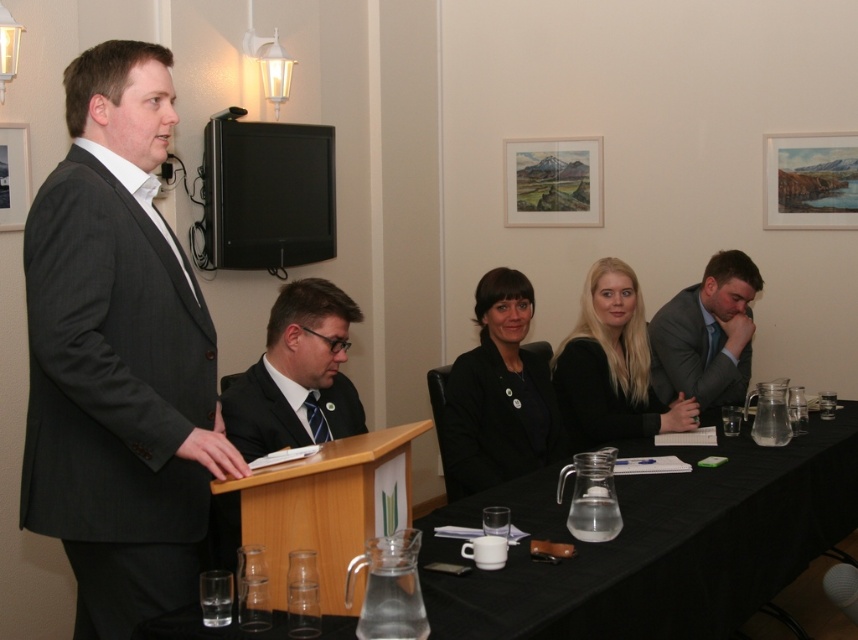
Question: Among these objects, which one is nearest to the camera?

Choices:
 (A) black matte jacket at center
 (B) black matte business suit at center
 (C) wooden podium at center

Answer: (C)

Question: Based on their relative distances, which object is farther from the blonde hair at center?

Choices:
 (A) wooden podium at center
 (B) matte black suit at right
 (C) black matte business suit at center

Answer: (A)

Question: Which point is closer to the camera taking this photo?

Choices:
 (A) (97, 296)
 (B) (300, 296)
 (C) (600, 378)

Answer: (A)

Question: Considering the relative positions of blonde hair at center and matte black suit at right in the image provided, where is blonde hair at center located with respect to matte black suit at right?

Choices:
 (A) above
 (B) below

Answer: (B)

Question: Is black matte jacket at center thinner than black matte business suit at center?

Choices:
 (A) no
 (B) yes

Answer: (B)

Question: Is dark gray suit at left to the right of clear glass table at center from the viewer's perspective?

Choices:
 (A) yes
 (B) no

Answer: (B)